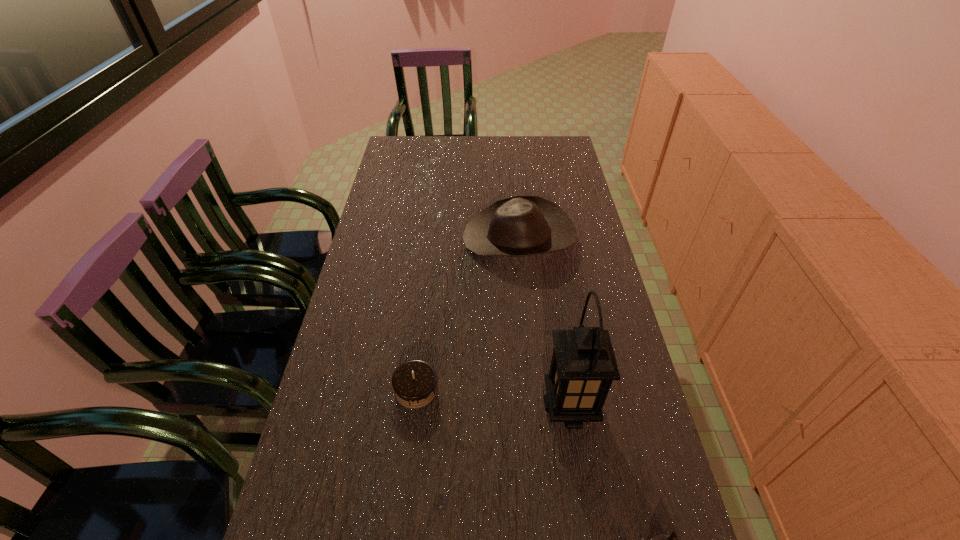
What are the coordinates of `lantern` in the screenshot? It's located at (583, 366).

Locate an element on the screen. The height and width of the screenshot is (540, 960). the third shortest object is located at coordinates (520, 226).

This screenshot has height=540, width=960. Identify the location of the farthest object. (520, 226).

This screenshot has width=960, height=540. What are the coordinates of `the second shortest object` in the screenshot? It's located at (414, 382).

Find the location of a particular element. This screenshot has width=960, height=540. the leftmost object is located at coordinates 414,382.

At what (x,y) coordinates should I click in order to perform the action: click on free space located on the back of the tallest object. Please return your answer as a coordinate pair (x, y). The height and width of the screenshot is (540, 960). Looking at the image, I should click on (560, 341).

Find the location of a particular element. The image size is (960, 540). blank space located on the right of the cowboy hat is located at coordinates (591, 238).

Where is `free point located on the right of the farther chocolate cake`? free point located on the right of the farther chocolate cake is located at coordinates (493, 389).

This screenshot has width=960, height=540. Identify the location of lantern situated at the right edge. (583, 366).

You are a GUI agent. You are given a task and a screenshot of the screen. Output one action in this format:
    pyautogui.click(x=<x>, y=<y>)
    Task: Click on the cowboy hat positioned at the right edge
    Image resolution: width=960 pixels, height=540 pixels.
    Given the screenshot: What is the action you would take?
    pyautogui.click(x=520, y=226)